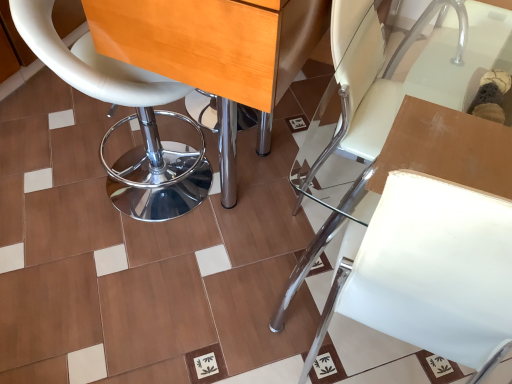
Question: Does wooden table at center lie behind white leather chair at center, the first chair in the right-to-left sequence?

Choices:
 (A) yes
 (B) no

Answer: (A)

Question: Does wooden table at center appear on the right side of white leather chair at center, the first chair in the right-to-left sequence?

Choices:
 (A) no
 (B) yes

Answer: (A)

Question: Is wooden table at center taller than white leather chair at center, placed as the 2th chair when sorted from left to right?

Choices:
 (A) yes
 (B) no

Answer: (A)

Question: From a real-world perspective, does wooden table at center sit lower than white leather chair at center, the first chair in the right-to-left sequence?

Choices:
 (A) yes
 (B) no

Answer: (B)

Question: Considering the relative sizes of wooden table at center and white leather chair at center, the first chair in the right-to-left sequence, in the image provided, is wooden table at center bigger than white leather chair at center, the first chair in the right-to-left sequence,?

Choices:
 (A) yes
 (B) no

Answer: (A)

Question: Would you say white leather chair at center, placed as the 2th chair when sorted from left to right, is part of wooden table at center's contents?

Choices:
 (A) no
 (B) yes

Answer: (A)

Question: Considering the relative positions of white leather stool at left, which is the 2th chair from right to left, and wooden table at center in the image provided, is white leather stool at left, which is the 2th chair from right to left, in front of wooden table at center?

Choices:
 (A) no
 (B) yes

Answer: (A)

Question: From a real-world perspective, is white leather stool at left, placed as the first chair when sorted from left to right, physically above wooden table at center?

Choices:
 (A) no
 (B) yes

Answer: (A)

Question: Is white leather stool at left, which is the 2th chair from right to left, outside of wooden table at center?

Choices:
 (A) yes
 (B) no

Answer: (B)

Question: Considering the relative sizes of white leather stool at left, placed as the first chair when sorted from left to right, and wooden table at center in the image provided, is white leather stool at left, placed as the first chair when sorted from left to right, shorter than wooden table at center?

Choices:
 (A) yes
 (B) no

Answer: (A)

Question: From the image's perspective, is white leather stool at left, which is the 2th chair from right to left, below wooden table at center?

Choices:
 (A) no
 (B) yes

Answer: (B)

Question: Does white leather stool at left, which is the 2th chair from right to left, have a greater height compared to wooden table at center?

Choices:
 (A) yes
 (B) no

Answer: (B)

Question: From the image's perspective, is white leather chair at center, the first chair in the right-to-left sequence, under white leather stool at left, placed as the first chair when sorted from left to right?

Choices:
 (A) yes
 (B) no

Answer: (A)